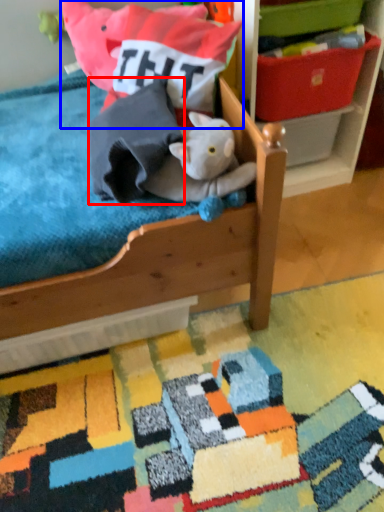
Question: Which object appears farthest to the camera in this image, throw pillow (highlighted by a red box) or pillow (highlighted by a blue box)?

Choices:
 (A) throw pillow
 (B) pillow

Answer: (B)